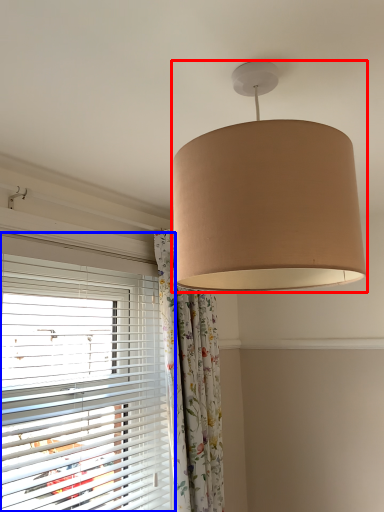
Question: Which object is closer to the camera taking this photo, lamp (highlighted by a red box) or window blind (highlighted by a blue box)?

Choices:
 (A) lamp
 (B) window blind

Answer: (A)